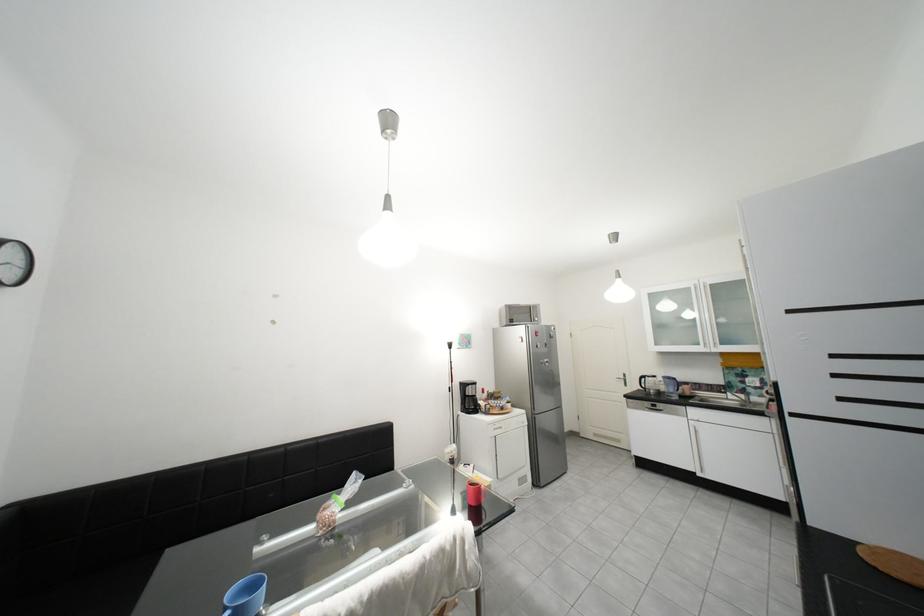
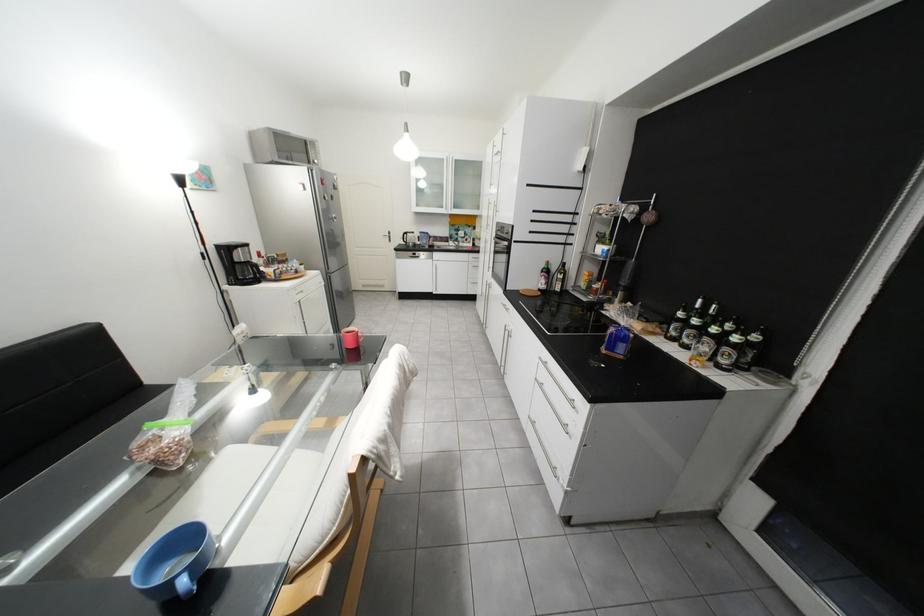
Where in the second image is the point corresponding to point 687,399 from the first image?

(439, 248)